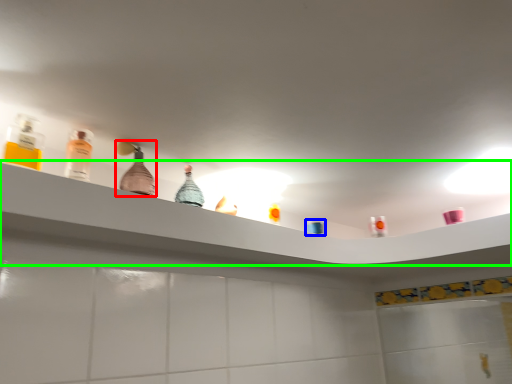
Question: Based on their relative distances, which object is nearer to bottle (highlighted by a red box)? Choose from toiletry (highlighted by a blue box) and shelf (highlighted by a green box).

Choices:
 (A) toiletry
 (B) shelf

Answer: (B)